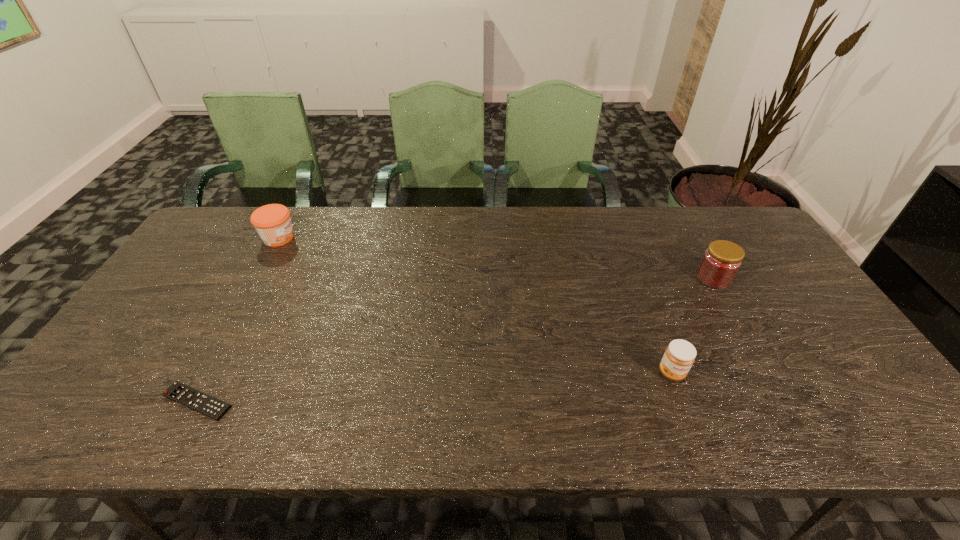
At what (x,y) coordinates should I click in order to perform the action: click on the third nearest object. Please return your answer as a coordinate pair (x, y). The width and height of the screenshot is (960, 540). Looking at the image, I should click on (722, 260).

In order to click on the rightmost object in this screenshot , I will do `click(722, 260)`.

Locate an element on the screen. The width and height of the screenshot is (960, 540). the leftmost jam is located at coordinates (272, 222).

I want to click on the farthest object, so click(272, 222).

Locate an element on the screen. The width and height of the screenshot is (960, 540). the third object from left to right is located at coordinates (679, 356).

Locate an element on the screen. This screenshot has height=540, width=960. the nearest jam is located at coordinates (679, 356).

What are the coordinates of `the shortest object` in the screenshot? It's located at (185, 395).

Identify the location of vacant area situated 0.080m on the back of the rightmost jam. The height and width of the screenshot is (540, 960). (698, 250).

At what (x,y) coordinates should I click in order to perform the action: click on vacant space located 0.200m on the front label of the farthest object. Please return your answer as a coordinate pair (x, y). Image resolution: width=960 pixels, height=540 pixels. Looking at the image, I should click on (357, 238).

What are the coordinates of `blank space located 0.310m on the right of the remote control` in the screenshot? It's located at (370, 401).